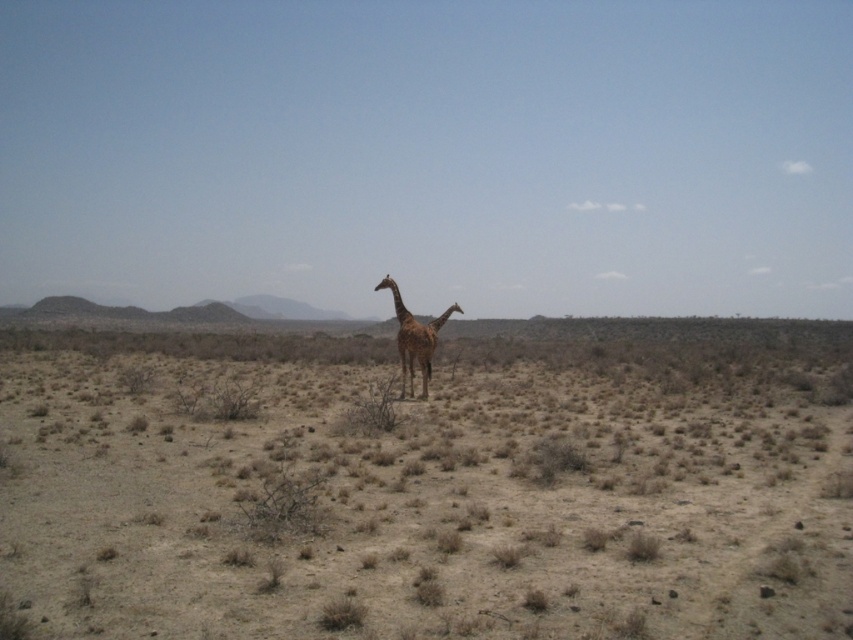
You are a researcher studying the vegetation distribution in this arid landscape. You have a GPS device that marks coordinates on the image. You notice a point labeled as point [430,484]. What does this point represent?

The point [430,484] represents the location of brown dry grass at center.

You are standing at the camera position looking at the point marked at coordinates (x=456, y=534) in the image. If you walk directly towards that point, how far will you have to walk to reach it?

The point marked at coordinates (x=456, y=534) is 24.77 feet away from the camera, so you would need to walk 24.77 feet to reach it.